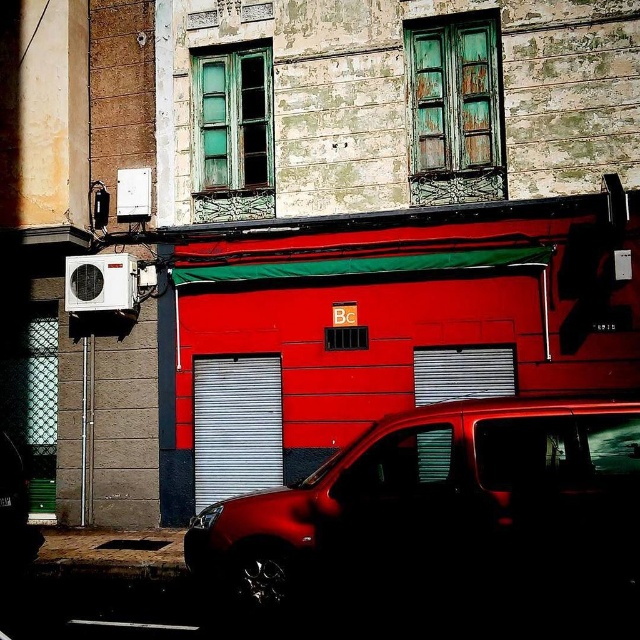
Consider the image. You are a delivery driver who needs to park your vehicle in the parking lot behind the red building. The parking space is exactly the same size as the metallic silver garage door at center. Can your glossy metallic van at center fit into the parking space?

The glossy metallic van at center has a larger size compared to the metallic silver garage door at center, so the van cannot fit into the parking space which is the same size as the garage door.

You are a delivery driver trying to park your 2.5m tall van. You see the glossy metallic van at center and the metallic silver garage door at center. Which one is shorter, allowing your van to pass underneath?

The glossy metallic van at center is not as tall as the metallic silver garage door at center, so the glossy metallic van at center is shorter. Therefore, your van can pass underneath the glossy metallic van at center since it is shorter than 2.5m.

You are driving a glossy metallic van at center and need to park it in a space that can only accommodate vehicles up to the width of the metallic silver garage door at center. Can your van fit within that space?

The glossy metallic van at center is wider than the metallic silver garage door at center, so it cannot fit within the space designed for the garage door.